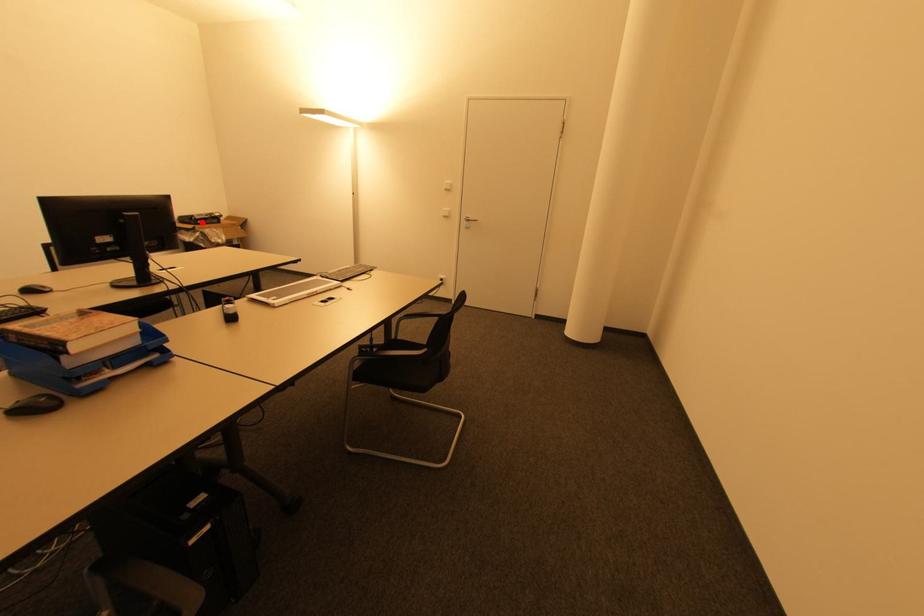
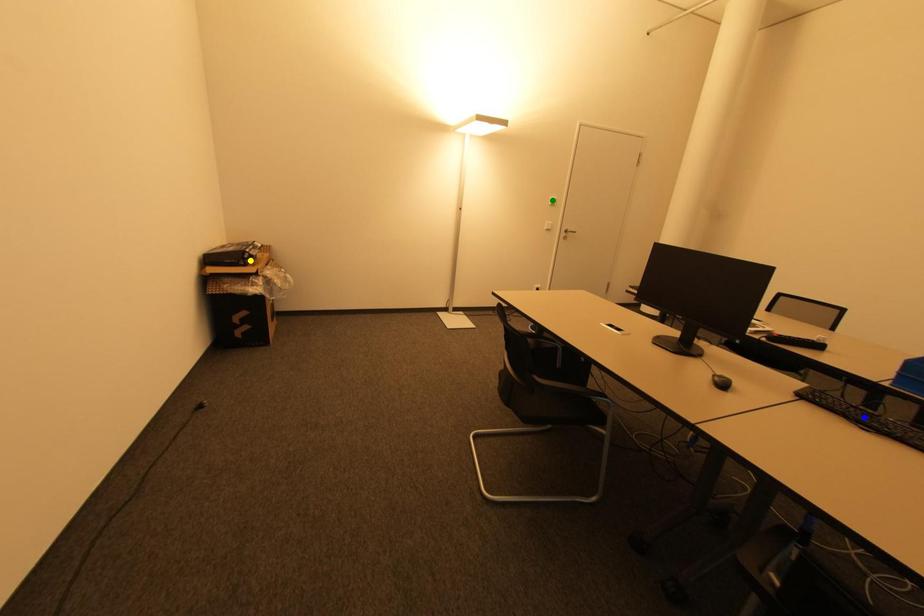
Question: I am providing you with two images of the same scene from different viewpoints. A red point is marked on the first image. You are given multiple points on the second image. In image 2, which mark is for the same physical point as the one in image 1?

Choices:
 (A) blue point
 (B) yellow point
 (C) green point

Answer: (B)